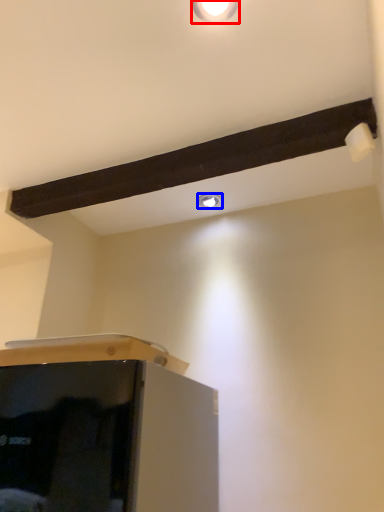
Question: Which object appears closest to the camera in this image, light fixture (highlighted by a red box) or droplight (highlighted by a blue box)?

Choices:
 (A) light fixture
 (B) droplight

Answer: (A)